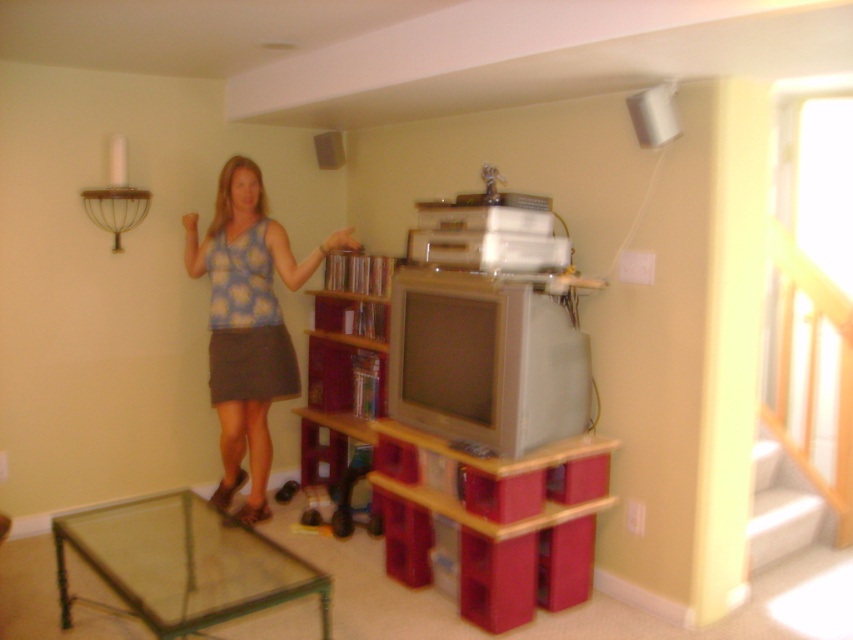
Which is in front, point (59, 515) or point (358, 289)?

Point (59, 515) is more forward.

Does point (109, 564) come farther from viewer compared to point (381, 339)?

No.

Image resolution: width=853 pixels, height=640 pixels. What do you see at coordinates (183, 563) in the screenshot?
I see `transparent glass table at lower left` at bounding box center [183, 563].

This screenshot has height=640, width=853. Identify the location of transparent glass table at lower left. (183, 563).

Who is lower down, blue floral tank top at center or wooden bookshelf at center?

Positioned lower is wooden bookshelf at center.

Where is `blue floral tank top at center`? blue floral tank top at center is located at coordinates (248, 323).

Who is more forward, (231, 384) or (345, 410)?

Positioned in front is point (231, 384).

I want to click on blue floral tank top at center, so click(x=248, y=323).

Looking at this image, is transparent glass table at lower left above blue floral tank top at center?

Incorrect, transparent glass table at lower left is not positioned above blue floral tank top at center.

Who is higher up, transparent glass table at lower left or blue floral tank top at center?

blue floral tank top at center

Is point (206, 611) farther from viewer compared to point (229, 209)?

No, it is in front of (229, 209).

Find the location of a particular element. The height and width of the screenshot is (640, 853). transparent glass table at lower left is located at coordinates (183, 563).